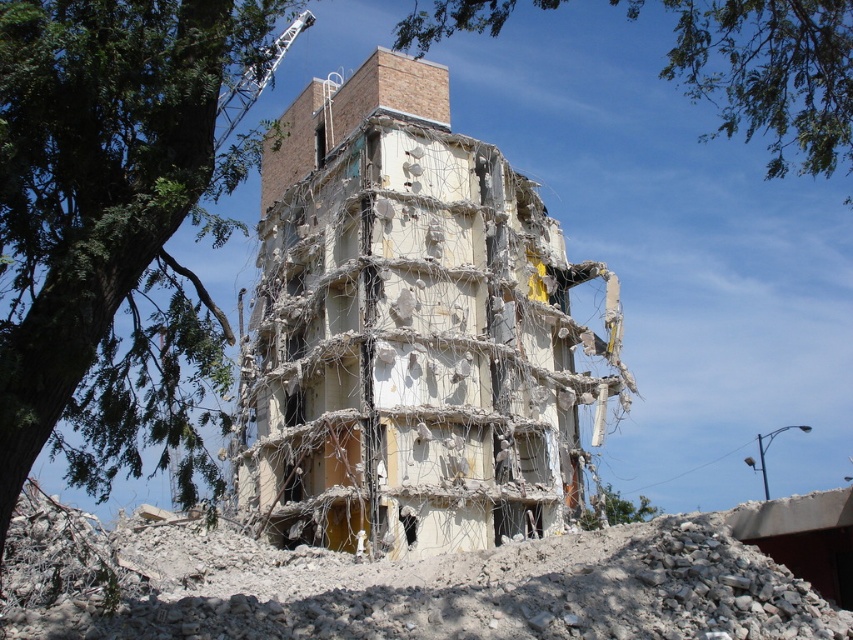
Question: Which point is farther to the camera?

Choices:
 (A) (834, 96)
 (B) (265, 275)

Answer: (B)

Question: Which point is farther to the camera?

Choices:
 (A) (277, 150)
 (B) (9, 408)

Answer: (A)

Question: Which object appears farthest from the camera in this image?

Choices:
 (A) green leafy tree at upper left
 (B) green leafy tree at upper center

Answer: (B)

Question: Is green leafy tree at upper left smaller than green leafy tree at upper center?

Choices:
 (A) yes
 (B) no

Answer: (A)

Question: Does green leafy tree at upper left have a greater width compared to green leafy tree at upper center?

Choices:
 (A) yes
 (B) no

Answer: (B)

Question: Does crumbled concrete building at center have a smaller size compared to green leafy tree at upper center?

Choices:
 (A) no
 (B) yes

Answer: (B)